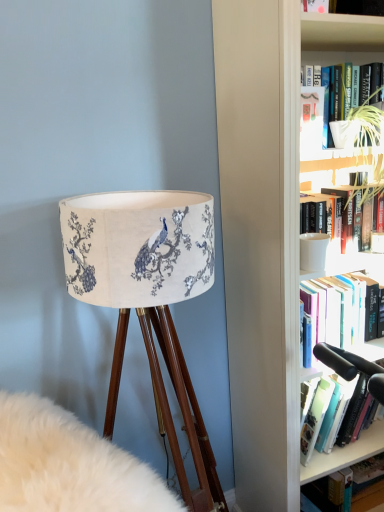
Question: Is matte white paperback book at upper right positioned behind hardcover book at lower right, the 1th book viewed from the back?

Choices:
 (A) no
 (B) yes

Answer: (A)

Question: Is matte white paperback book at upper right to the right of hardcover book at lower right, which appears as the first book when ordered from the bottom, from the viewer's perspective?

Choices:
 (A) yes
 (B) no

Answer: (B)

Question: From the image's perspective, is matte white paperback book at upper right under hardcover book at lower right, placed as the 2th book when sorted from top to bottom?

Choices:
 (A) yes
 (B) no

Answer: (B)

Question: Can you confirm if matte white paperback book at upper right is taller than hardcover book at lower right, the 1th book viewed from the back?

Choices:
 (A) yes
 (B) no

Answer: (A)

Question: Is matte white paperback book at upper right smaller than hardcover book at lower right, the 1th book viewed from the back?

Choices:
 (A) yes
 (B) no

Answer: (A)

Question: Is matte white paperback book at upper right far away from hardcover book at lower right, the 1th book viewed from the back?

Choices:
 (A) yes
 (B) no

Answer: (A)

Question: Could you tell me if wooden tripod lamp at left is facing matte fabric lampshade at left?

Choices:
 (A) yes
 (B) no

Answer: (A)

Question: Would you say wooden tripod lamp at left contains matte fabric lampshade at left?

Choices:
 (A) no
 (B) yes

Answer: (A)

Question: From the image's perspective, would you say wooden tripod lamp at left is shown under matte fabric lampshade at left?

Choices:
 (A) yes
 (B) no

Answer: (A)

Question: From a real-world perspective, does wooden tripod lamp at left stand above matte fabric lampshade at left?

Choices:
 (A) yes
 (B) no

Answer: (B)

Question: Is wooden tripod lamp at left positioned far away from matte fabric lampshade at left?

Choices:
 (A) no
 (B) yes

Answer: (A)

Question: Considering the relative sizes of wooden tripod lamp at left and matte fabric lampshade at left in the image provided, is wooden tripod lamp at left shorter than matte fabric lampshade at left?

Choices:
 (A) yes
 (B) no

Answer: (A)

Question: Is wooden tripod lamp at left at the left side of matte white paperback book at upper right?

Choices:
 (A) no
 (B) yes

Answer: (B)